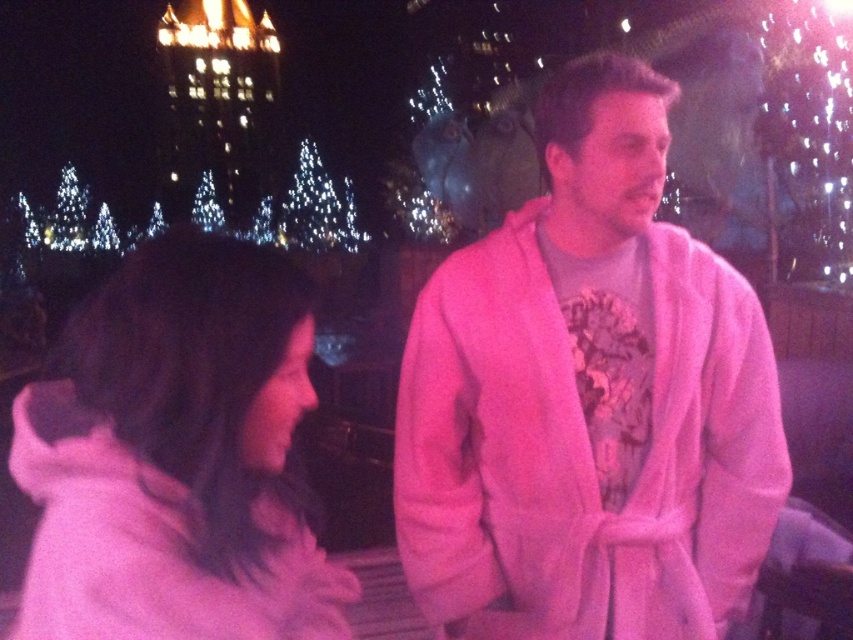
Does point (711, 268) come closer to viewer compared to point (254, 305)?

No.

Is pink fleece robe at center positioned before white fluffy coat at left?

No.

Locate an element on the screen. The height and width of the screenshot is (640, 853). pink fleece robe at center is located at coordinates (x=589, y=401).

Where is `pink fleece robe at center`? This screenshot has height=640, width=853. pink fleece robe at center is located at coordinates (589, 401).